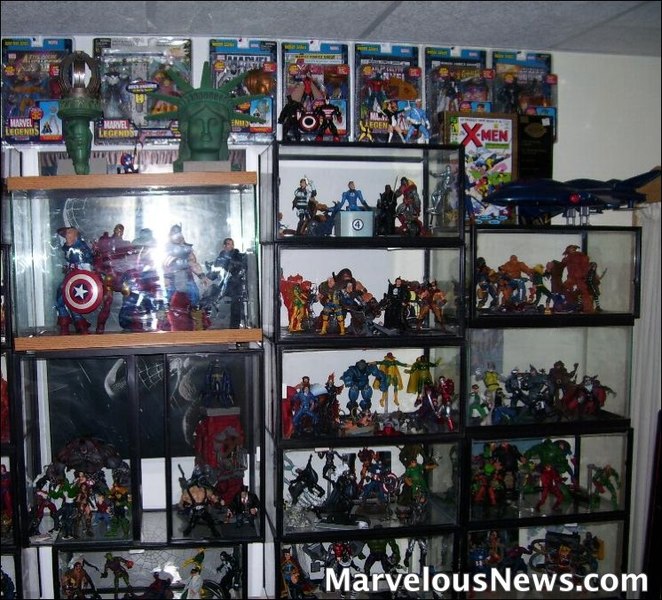
The width and height of the screenshot is (662, 600). Identify the location of white ceiling panels. (333, 19), (506, 23), (71, 20), (621, 39).